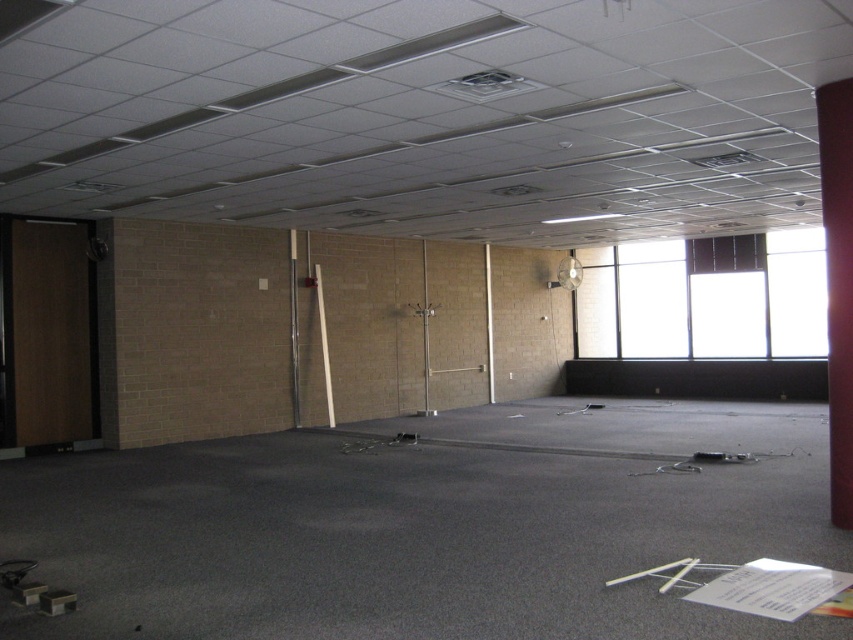
You are an interior designer assessing the office space. You need to determine which object, the transparent glass window at upper right or the red matte pillar at right, would allow more natural light into the room. Which one do you choose?

The transparent glass window at upper right is larger in size than the red matte pillar at right, so it would allow more natural light into the room.

You are an office cleaner who needs to clean the transparent glass window at upper right and the red matte pillar at right. Which object should you clean first if you want to start from the highest point in the room?

The transparent glass window at upper right is located above the red matte pillar at right, so you should clean the transparent glass window at upper right first since it is higher up.

You are standing at the entrance of the office and see two points marked on the floor. The first point is at coordinate point (x=650, y=349) and the second is at point (x=831, y=413). If you want to reach the point that is closer to the entrance, which coordinate should you head towards?

Point (x=831, y=413) is closer to the entrance because it is in front of point (x=650, y=349), which is behind it.